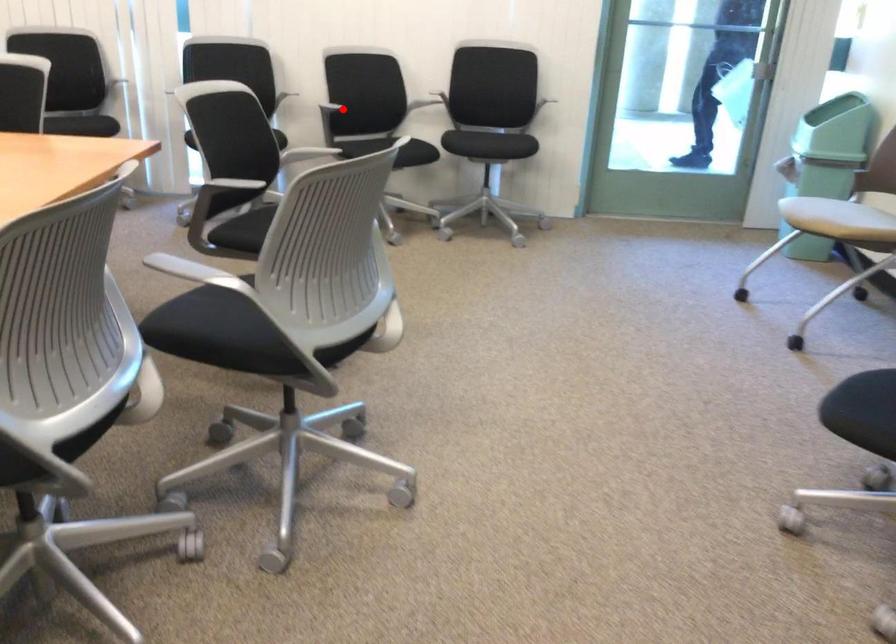
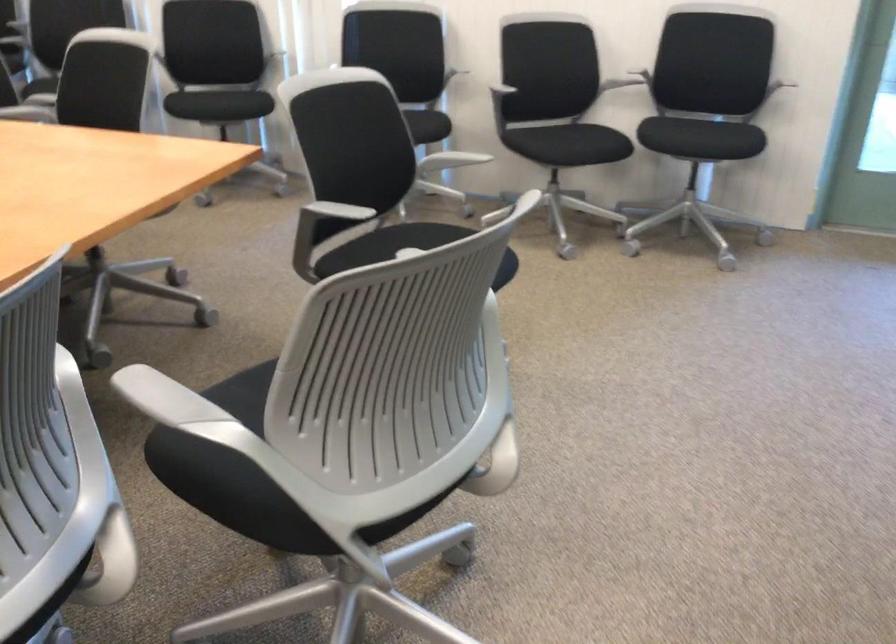
Question: A red point is marked in image1. In image2, is the corresponding 3D point closer to the camera or farther? Reply with the corresponding letter.

Choices:
 (A) The corresponding 3D point is closer.
 (B) The corresponding 3D point is farther.

Answer: (A)